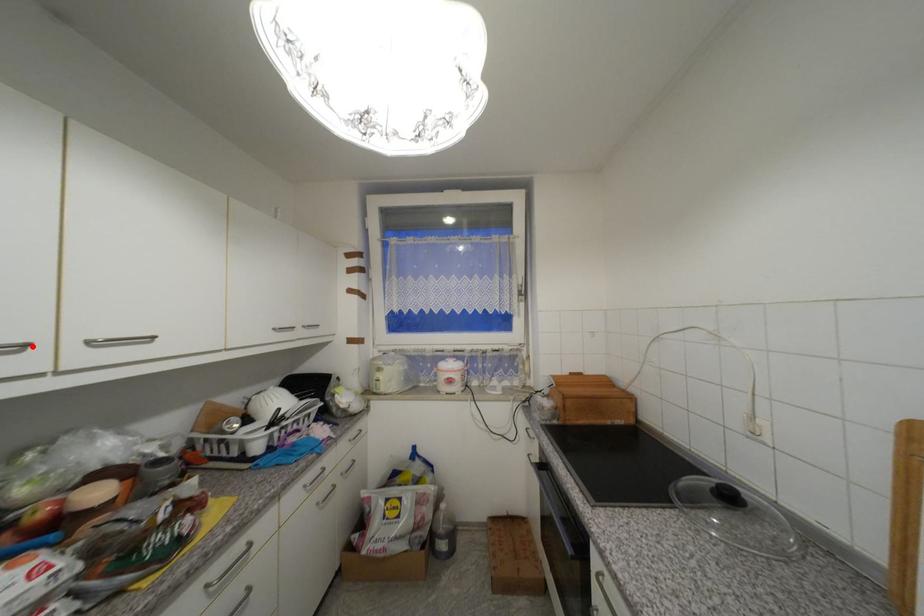
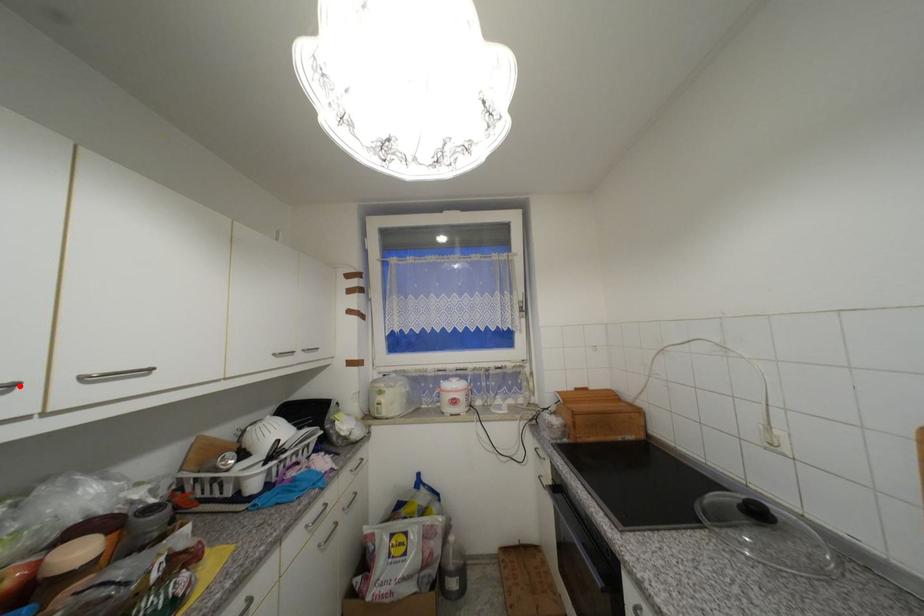
Based on the photo, I am providing you with two images of the same scene from different viewpoints. A red point is marked on the first image and another point is marked on the second image. Is the marked point in image1 the same physical position as the marked point in image2?

Yes